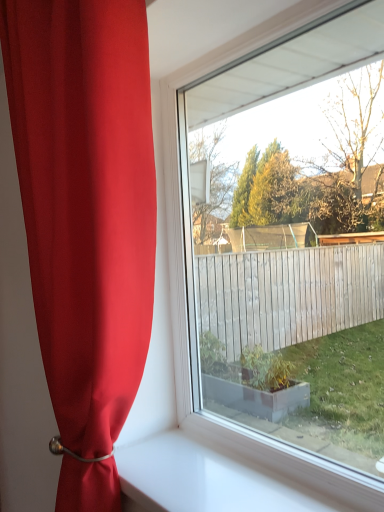
The image size is (384, 512). Describe the element at coordinates (85, 217) in the screenshot. I see `matte red curtain at left` at that location.

The width and height of the screenshot is (384, 512). I want to click on matte red curtain at left, so click(x=85, y=217).

Where is `matte red curtain at left`? matte red curtain at left is located at coordinates (85, 217).